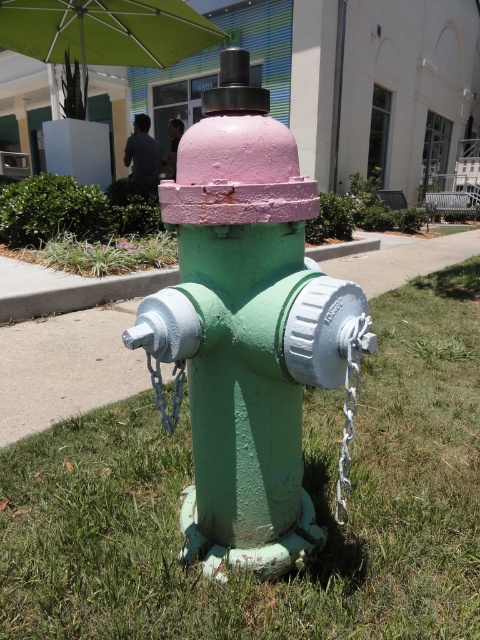
You are standing at the origin point of the coordinate system in the image. The fire hydrant is in front of you. Which direction should you move to reach the green matte grass at lower center?

To reach the green matte grass at lower center, you should move towards the coordinate point (303, 484) from the origin point.

You are a gardener who needs to mow the green matte grass at lower center and secure the metallic chain at center. Which task should you tackle first if you want to address the larger area first?

The green matte grass at lower center is bigger than the metallic chain at center, so you should mow the green matte grass at lower center first to address the larger area first.

From the picture: You are standing at the base of the fire hydrant and want to take a photo of the green fabric umbrella at upper center using a camera. The camera is 7.26 meters away from the umbrella. Can you reach the camera from your current position without moving the hydrant?

The camera is 7.26 meters away from the green fabric umbrella at upper center. Since you are at the hydrant, you can reach the camera by walking 7.26 meters towards it, so yes, you can reach the camera from your current position without moving the hydrant.